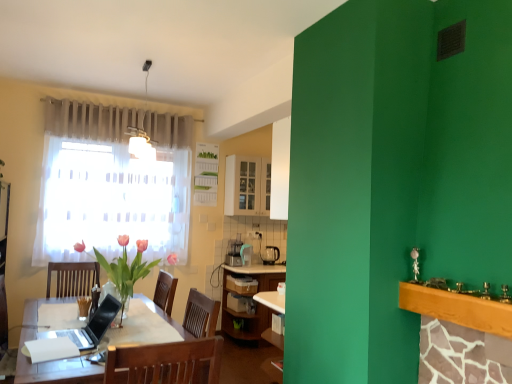
Question: Is wooden chair at center next to black plastic coffee maker at center and touching it?

Choices:
 (A) yes
 (B) no

Answer: (B)

Question: From a real-world perspective, is wooden chair at center on black plastic coffee maker at center?

Choices:
 (A) yes
 (B) no

Answer: (B)

Question: Is black plastic coffee maker at center a part of wooden chair at center?

Choices:
 (A) yes
 (B) no

Answer: (B)

Question: Is wooden chair at center located outside black plastic coffee maker at center?

Choices:
 (A) no
 (B) yes

Answer: (B)

Question: From the image's perspective, is wooden chair at center over black plastic coffee maker at center?

Choices:
 (A) yes
 (B) no

Answer: (B)

Question: In terms of height, does black glossy laptop at center look taller or shorter compared to pink glass vase at left?

Choices:
 (A) tall
 (B) short

Answer: (B)

Question: From the image's perspective, relative to pink glass vase at left, is black glossy laptop at center above or below?

Choices:
 (A) below
 (B) above

Answer: (A)

Question: Considering the positions of point (93, 344) and point (110, 276), is point (93, 344) closer or farther from the camera than point (110, 276)?

Choices:
 (A) closer
 (B) farther

Answer: (A)

Question: Would you say black glossy laptop at center is to the left or to the right of pink glass vase at left in the picture?

Choices:
 (A) left
 (B) right

Answer: (A)

Question: From the image's perspective, is pink glass vase at left above or below white glossy cabinet at upper center?

Choices:
 (A) above
 (B) below

Answer: (B)

Question: Based on their sizes in the image, would you say pink glass vase at left is bigger or smaller than white glossy cabinet at upper center?

Choices:
 (A) big
 (B) small

Answer: (A)

Question: Considering the positions of pink glass vase at left and white glossy cabinet at upper center in the image, is pink glass vase at left taller or shorter than white glossy cabinet at upper center?

Choices:
 (A) short
 (B) tall

Answer: (A)

Question: From a real-world perspective, relative to white glossy cabinet at upper center, is pink glass vase at left vertically above or below?

Choices:
 (A) below
 (B) above

Answer: (A)

Question: Considering the positions of point (476, 299) and point (60, 334), is point (476, 299) closer or farther from the camera than point (60, 334)?

Choices:
 (A) farther
 (B) closer

Answer: (B)

Question: From a real-world perspective, is wooden mantle at upper right physically located above or below black glossy laptop at center?

Choices:
 (A) above
 (B) below

Answer: (A)